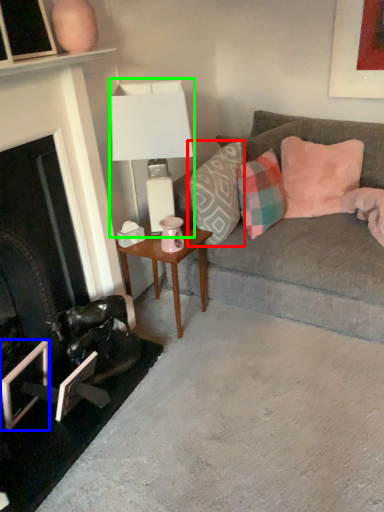
Question: Estimate the real-world distances between objects in this image. Which object is farther from pillow (highlighted by a red box), picture frame (highlighted by a blue box) or table lamp (highlighted by a green box)?

Choices:
 (A) picture frame
 (B) table lamp

Answer: (A)